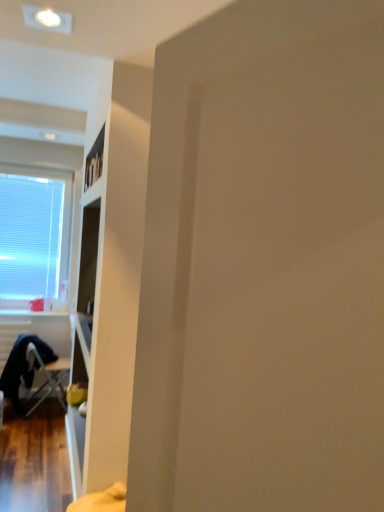
Question: Is metallic silver folding chair at lower left situated inside white blinds at left or outside?

Choices:
 (A) outside
 (B) inside

Answer: (A)

Question: In the image, is metallic silver folding chair at lower left positioned in front of or behind white blinds at left?

Choices:
 (A) front
 (B) behind

Answer: (A)

Question: Is metallic silver folding chair at lower left taller or shorter than white blinds at left?

Choices:
 (A) tall
 (B) short

Answer: (B)

Question: From the image's perspective, relative to metallic silver folding chair at lower left, is white blinds at left above or below?

Choices:
 (A) above
 (B) below

Answer: (A)

Question: From their relative heights in the image, would you say white blinds at left is taller or shorter than metallic silver folding chair at lower left?

Choices:
 (A) tall
 (B) short

Answer: (A)

Question: In terms of width, does white blinds at left look wider or thinner when compared to metallic silver folding chair at lower left?

Choices:
 (A) thin
 (B) wide

Answer: (A)

Question: Is point [39, 215] positioned closer to the camera than point [61, 368]?

Choices:
 (A) farther
 (B) closer

Answer: (A)